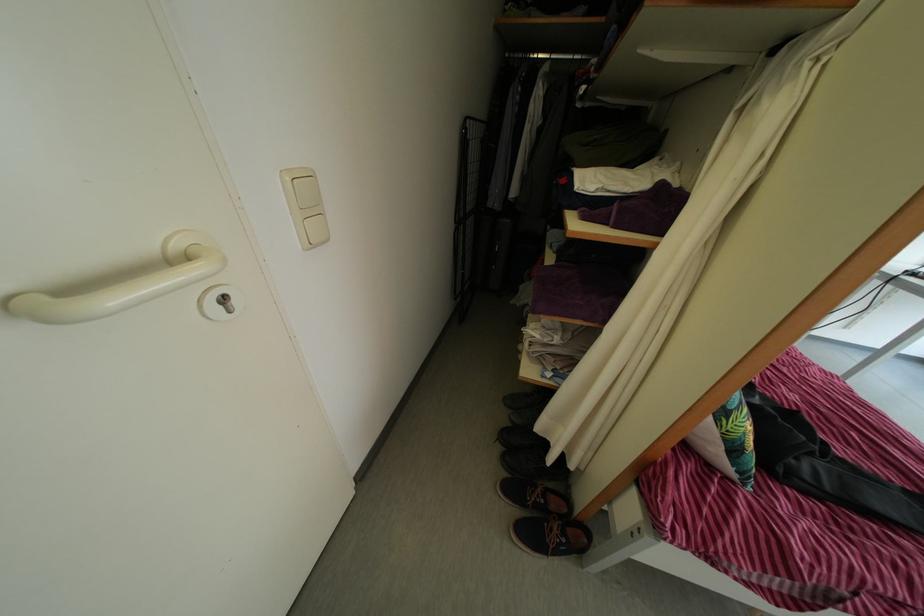
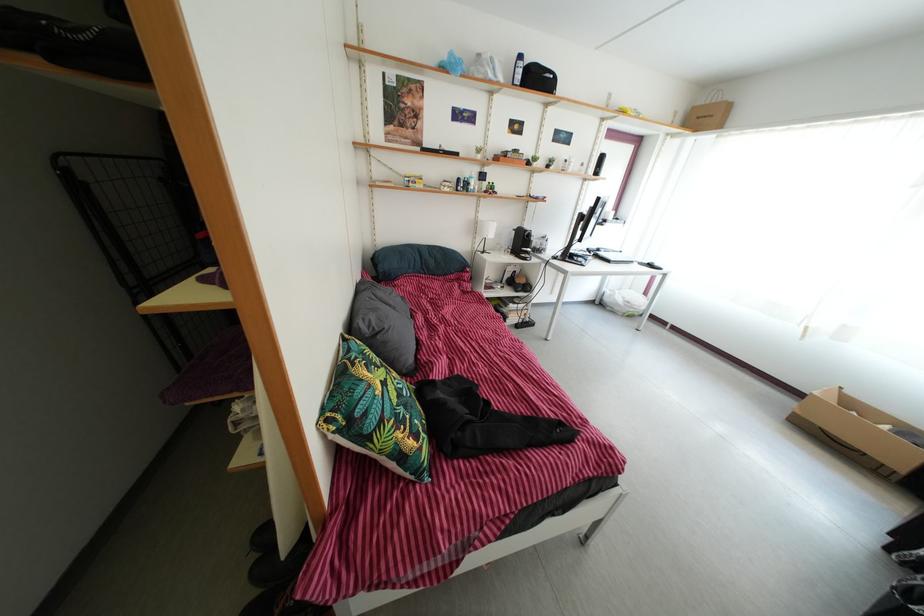
Question: The camera is either moving clockwise (left) or counter-clockwise (right) around the object. The first image is from the beginning of the video and the second image is from the end. Is the camera moving left or right when shooting the video?

Choices:
 (A) Left
 (B) Right

Answer: (A)